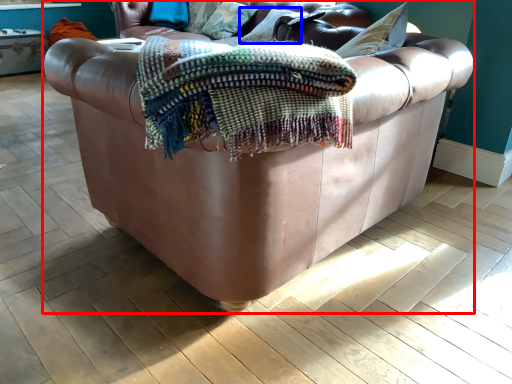
Question: Which object is closer to the camera taking this photo, studio couch (highlighted by a red box) or pillow (highlighted by a blue box)?

Choices:
 (A) studio couch
 (B) pillow

Answer: (A)